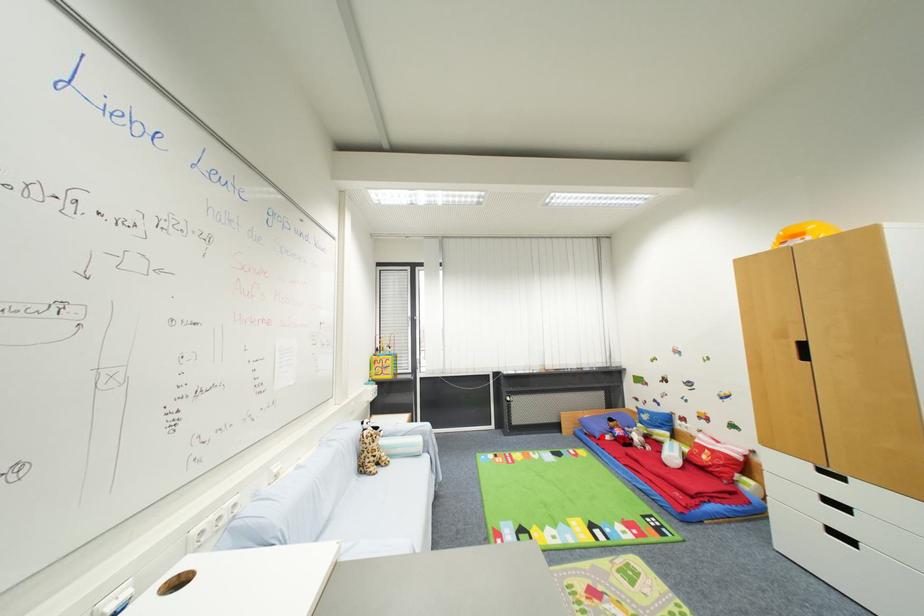
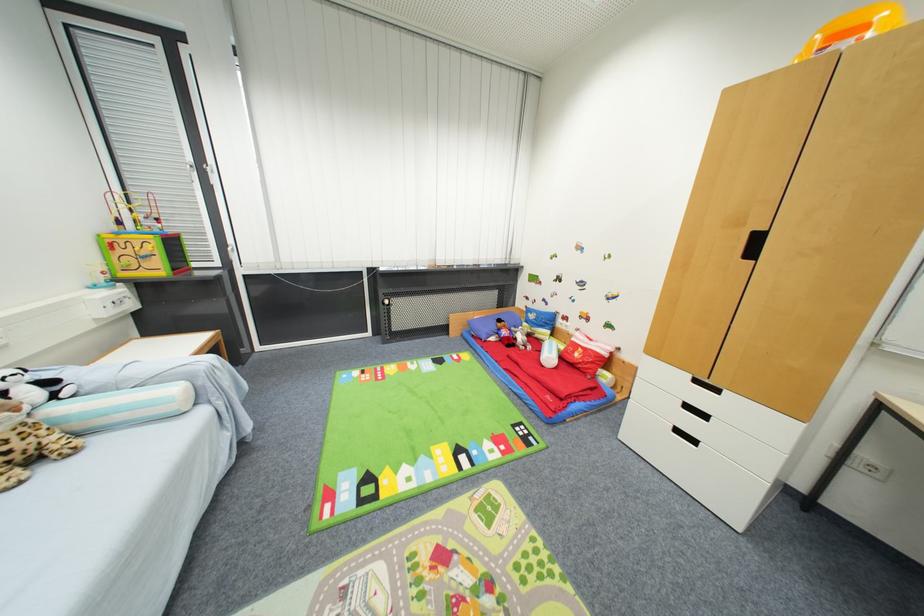
Question: I am providing you with two images of the same scene from different viewpoints. A red point is shown in image1. For the corresponding object point in image2, is it positioned nearer or farther from the camera?

Choices:
 (A) Nearer
 (B) Farther

Answer: (A)